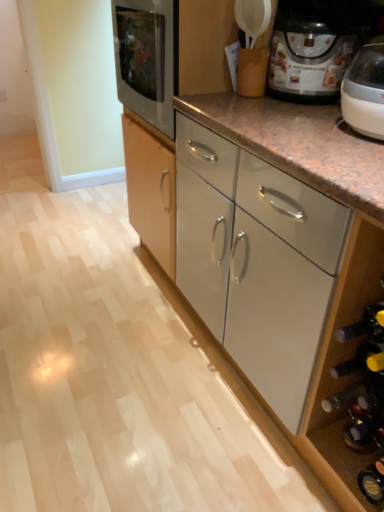
Question: From the image's perspective, is matte black wine bottle at lower right located above or below matte black coffee maker at upper right?

Choices:
 (A) above
 (B) below

Answer: (B)

Question: From a real-world perspective, relative to matte black coffee maker at upper right, is matte black wine bottle at lower right vertically above or below?

Choices:
 (A) below
 (B) above

Answer: (A)

Question: Based on their relative distances, which object is farther from the white glossy cabinet at center?

Choices:
 (A) matte black wine bottle at lower right
 (B) matte black coffee maker at upper right

Answer: (A)

Question: Which of these objects is positioned closest to the white glossy cabinet at center?

Choices:
 (A) matte black wine bottle at lower right
 (B) matte black coffee maker at upper right

Answer: (B)